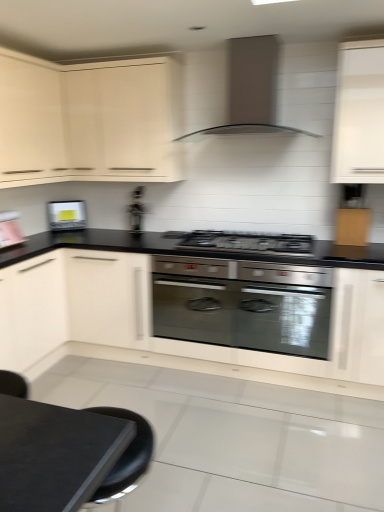
Question: Is matte cream cabinet at upper left, which appears as the 3th cabinetry when viewed from the left, completely or partially outside of matte white cabinet at upper left, which appears as the 3th cabinetry when viewed from the right?

Choices:
 (A) no
 (B) yes

Answer: (B)

Question: From the image's perspective, is matte cream cabinet at upper left, which appears as the 3th cabinetry when viewed from the left, beneath matte white cabinet at upper left, which appears as the 3th cabinetry when viewed from the right?

Choices:
 (A) no
 (B) yes

Answer: (A)

Question: Can you confirm if matte cream cabinet at upper left, arranged as the 2th cabinetry when viewed from the right, is wider than matte white cabinet at upper left, which ranks as the second cabinetry in left-to-right order?

Choices:
 (A) yes
 (B) no

Answer: (B)

Question: Is matte cream cabinet at upper left, arranged as the 2th cabinetry when viewed from the right, taller than matte white cabinet at upper left, which appears as the 3th cabinetry when viewed from the right?

Choices:
 (A) no
 (B) yes

Answer: (A)

Question: Is the position of matte cream cabinet at upper left, which appears as the 3th cabinetry when viewed from the left, less distant than that of matte white cabinet at upper left, which ranks as the second cabinetry in left-to-right order?

Choices:
 (A) no
 (B) yes

Answer: (A)

Question: Considering the relative sizes of matte cream cabinet at upper left, arranged as the 2th cabinetry when viewed from the right, and matte white cabinet at upper left, which appears as the 3th cabinetry when viewed from the right, in the image provided, is matte cream cabinet at upper left, arranged as the 2th cabinetry when viewed from the right, bigger than matte white cabinet at upper left, which appears as the 3th cabinetry when viewed from the right,?

Choices:
 (A) yes
 (B) no

Answer: (B)

Question: Is metallic silver toaster at center bigger than satin metallic range hood at upper center?

Choices:
 (A) yes
 (B) no

Answer: (B)

Question: Could you tell me if metallic silver toaster at center is facing satin metallic range hood at upper center?

Choices:
 (A) yes
 (B) no

Answer: (B)

Question: Does metallic silver toaster at center have a lesser height compared to satin metallic range hood at upper center?

Choices:
 (A) no
 (B) yes

Answer: (B)

Question: Is metallic silver toaster at center in contact with satin metallic range hood at upper center?

Choices:
 (A) no
 (B) yes

Answer: (A)

Question: Are metallic silver toaster at center and satin metallic range hood at upper center located far from each other?

Choices:
 (A) yes
 (B) no

Answer: (A)

Question: Does metallic silver toaster at center have a greater width compared to satin metallic range hood at upper center?

Choices:
 (A) yes
 (B) no

Answer: (B)

Question: Considering the relative sizes of satin black gas stove at center and metallic silver toaster at center in the image provided, is satin black gas stove at center wider than metallic silver toaster at center?

Choices:
 (A) yes
 (B) no

Answer: (A)